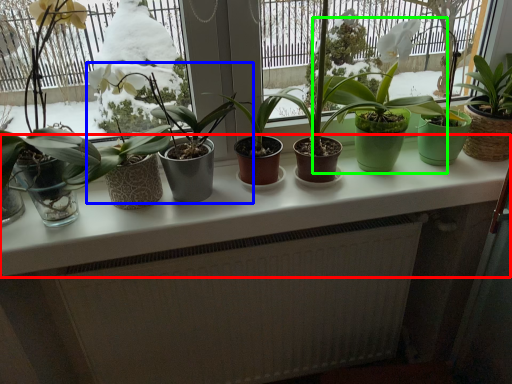
Question: Which is farther away from counter top (highlighted by a red box)? houseplant (highlighted by a blue box) or houseplant (highlighted by a green box)?

Choices:
 (A) houseplant
 (B) houseplant

Answer: (B)